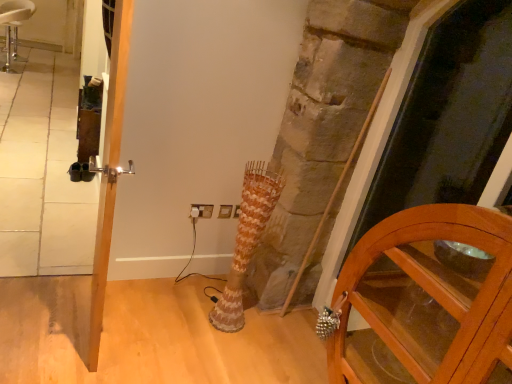
Question: Would you say transparent glass screen door at right is inside or outside wooden cabinet at lower right?

Choices:
 (A) outside
 (B) inside

Answer: (A)

Question: Considering their positions, is transparent glass screen door at right located in front of or behind wooden cabinet at lower right?

Choices:
 (A) front
 (B) behind

Answer: (B)

Question: Estimate the real-world distances between objects in this image. Which object is farther from the wooden cabinet at lower right?

Choices:
 (A) white plastic electric outlet at center
 (B) polished silver door handle at left
 (C) white leather stool at upper left
 (D) transparent glass screen door at right

Answer: (C)

Question: Estimate the real-world distances between objects in this image. Which object is closer to the transparent glass screen door at right?

Choices:
 (A) wooden cabinet at lower right
 (B) white leather stool at upper left
 (C) polished silver door handle at left
 (D) white plastic electric outlet at center

Answer: (A)